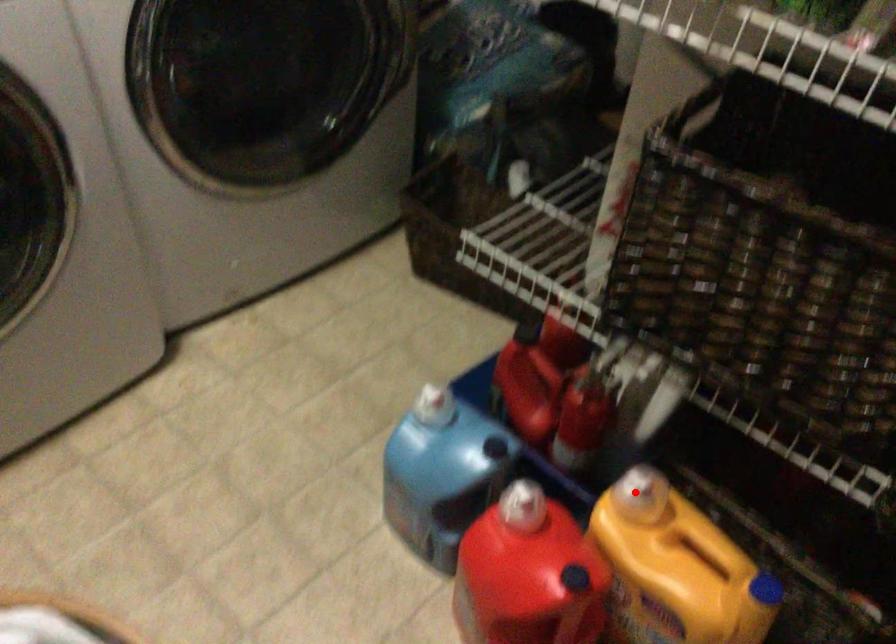
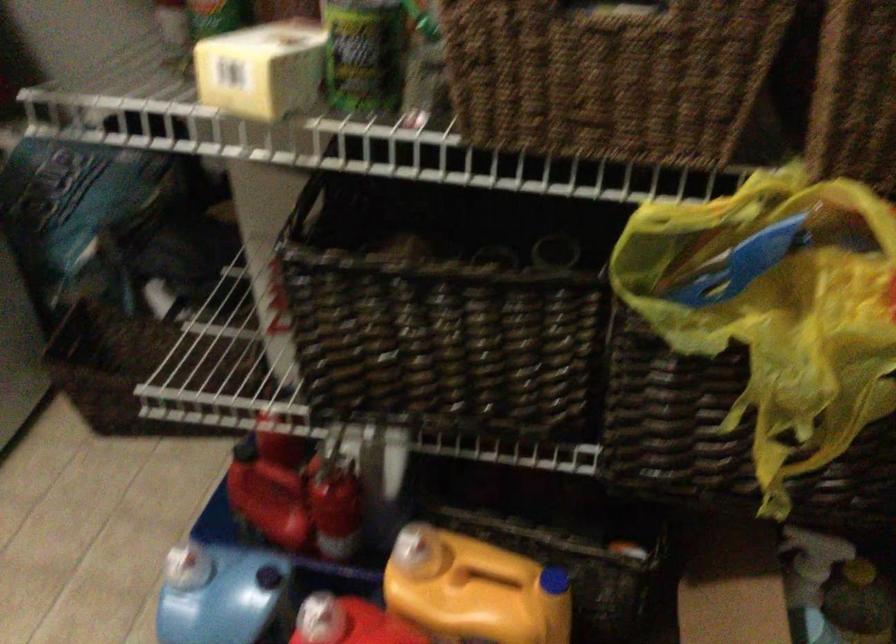
Where in the second image is the point corresponding to the highlighted location from the first image?

(409, 550)